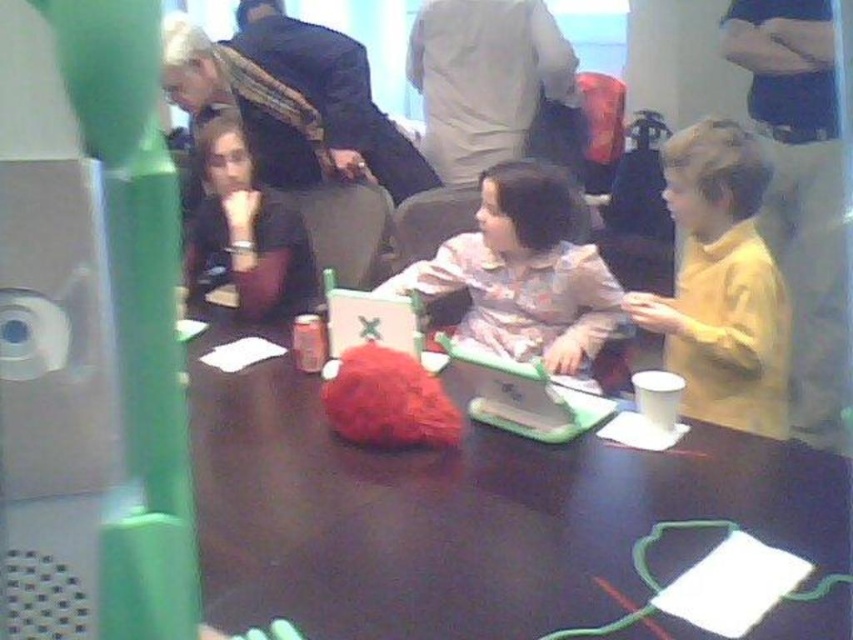
You are a photographer trying to capture the shiny brown table at center without the matte black shirt at left appearing in the shot. Is this possible based on their positions?

The shiny brown table at center is positioned under the matte black shirt at left, so adjusting the camera angle slightly upward might allow you to frame the table without the shirt obstructing the view.

You are standing in the room and want to reach the shiny brown table at center. According to the coordinates provided, is the table closer to the left or right side of the room?

The shiny brown table at center is located at point (461, 515). Since the x coordinate is 0.806, which is closer to 1.0, the table is closer to the right side of the room.

You are a photographer standing at the camera position. You want to take a closeup photo of the fluffy pink sweater at center. However, there is a white disposable cup on the table. Can you move the cup to get a better shot?

The distance between the fluffy pink sweater at center and the camera is 6.68 feet. Since the cup is on the table, moving it would allow you to have a clear view of the sweater for the closeup photo.